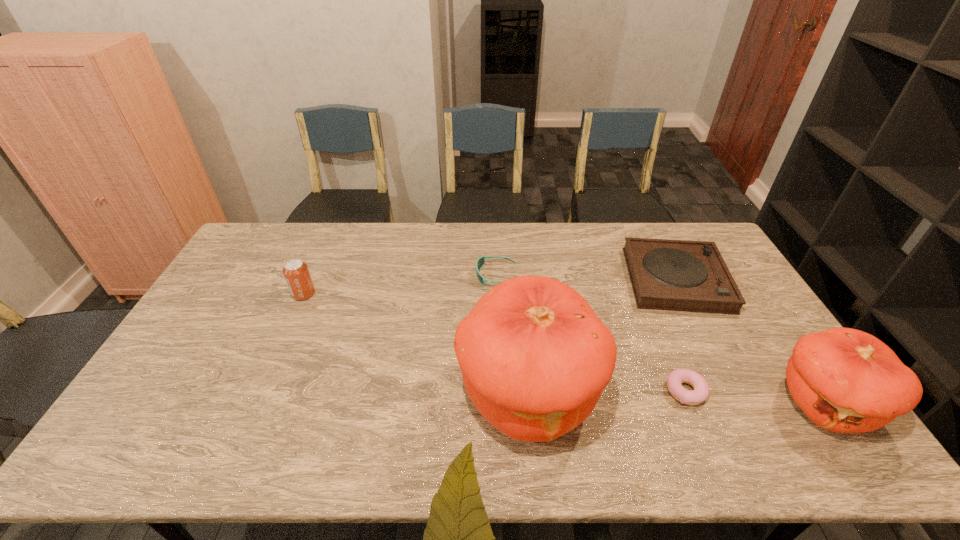
Where is `phonograph record situated at the right edge`? phonograph record situated at the right edge is located at coordinates (676, 275).

The image size is (960, 540). Identify the location of object that is at the far right corner. (676, 275).

Find the location of a particular element. The image size is (960, 540). object present at the near right corner is located at coordinates (845, 380).

I want to click on vacant region at the far edge of the desktop, so click(487, 224).

This screenshot has height=540, width=960. In the image, there is a desktop. What are the coordinates of `free space at the near edge` in the screenshot? It's located at (386, 401).

In the image, there is a desktop. Where is `free space at the left edge`? The image size is (960, 540). free space at the left edge is located at coordinates (152, 384).

I want to click on free space at the right edge of the desktop, so click(x=720, y=314).

The height and width of the screenshot is (540, 960). I want to click on vacant space at the far left corner of the desktop, so click(265, 225).

Where is `free space between the second shortest object and the right pumpkin`? The height and width of the screenshot is (540, 960). free space between the second shortest object and the right pumpkin is located at coordinates 660,340.

This screenshot has width=960, height=540. I want to click on vacant space that is in between the sunglasses and the phonograph record, so click(x=587, y=278).